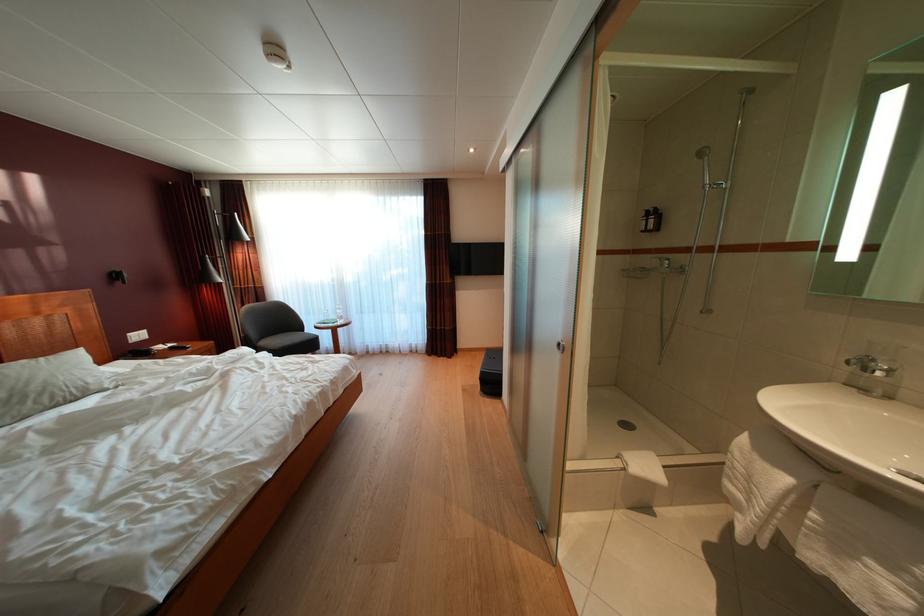
Find where to lift the silver shower head. Please return your answer as a coordinate pair (x, y).

(702, 152)